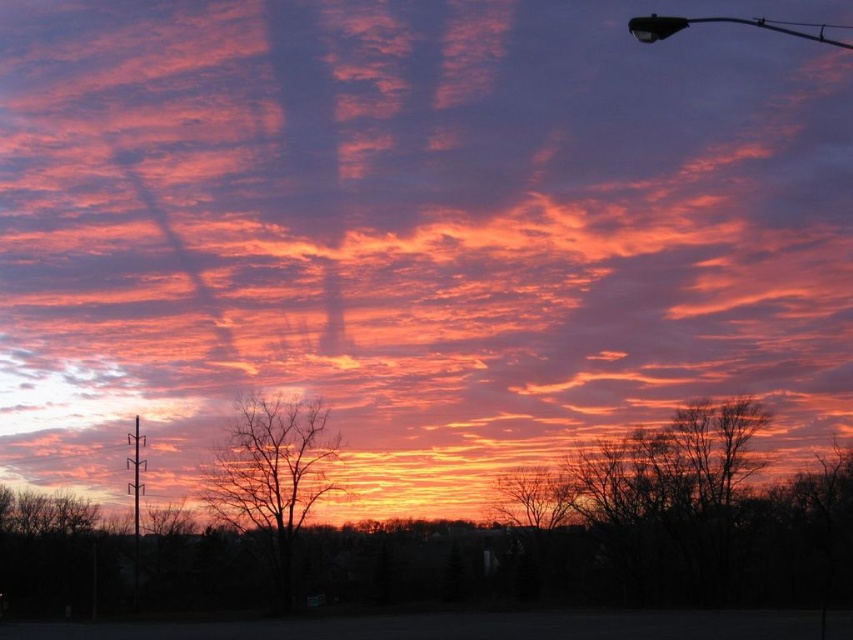
Question: Which point is farther to the camera?

Choices:
 (A) metallic gray pole at left
 (B) metallic pole at upper right
 (C) silhouette bare tree at center

Answer: (A)

Question: Which object is positioned closest to the metallic gray pole at left?

Choices:
 (A) silhouette bare tree at center
 (B) metallic pole at upper right

Answer: (A)

Question: Does metallic pole at upper right appear over metallic gray pole at left?

Choices:
 (A) yes
 (B) no

Answer: (A)

Question: Which point is farther to the camera?

Choices:
 (A) (143, 445)
 (B) (837, 40)
 (C) (248, 403)

Answer: (B)

Question: Can you confirm if silhouette bare tree at center is positioned to the left of metallic pole at upper right?

Choices:
 (A) yes
 (B) no

Answer: (A)

Question: Does silhouette bare tree at center appear over metallic gray pole at left?

Choices:
 (A) yes
 (B) no

Answer: (A)